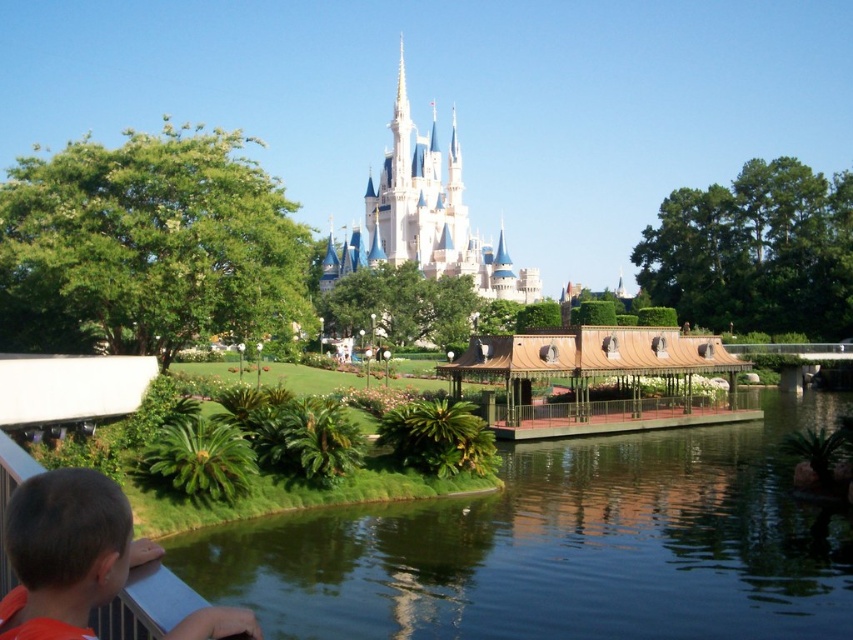
You are standing at the center of the scene looking towards the castle. Where would you see the orange fabric shirt at lower left from your current position?

The orange fabric shirt at lower left is located at the lower left area of the scene, so from the center position facing the castle, you would need to look to your left and downward to see it.

You are a photographer planning to capture the entire scene of the theme park. You notice the green smooth water at center and the orange fabric shirt at lower left. Which object is wider in the image?

The green smooth water at center is wider than the orange fabric shirt at lower left.

You are standing in the theme park and want to take a photo of both the point at coordinates point (x=421, y=604) and point (x=97, y=564). Which point should you focus on first to ensure both are in focus?

You should focus on point (x=97, y=564) first because it is closer to the camera than point (x=421, y=604). By focusing on the closer point, the farther point will also be in focus due to the depth of field.